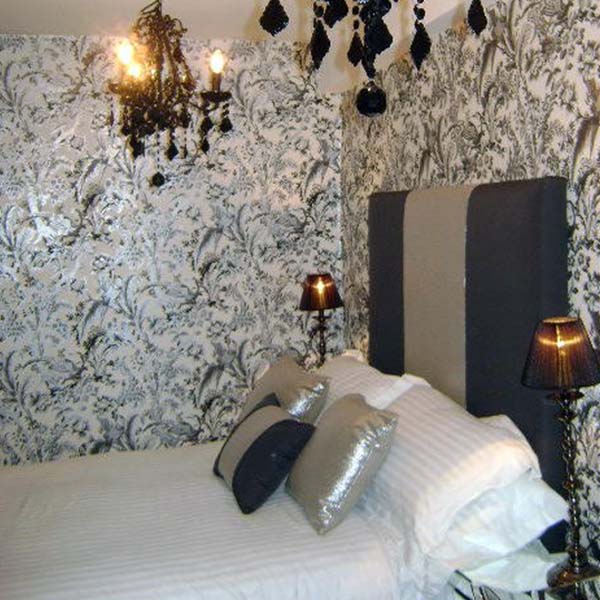
Find the location of a particular element. The image size is (600, 600). pillow is located at coordinates (416, 485).